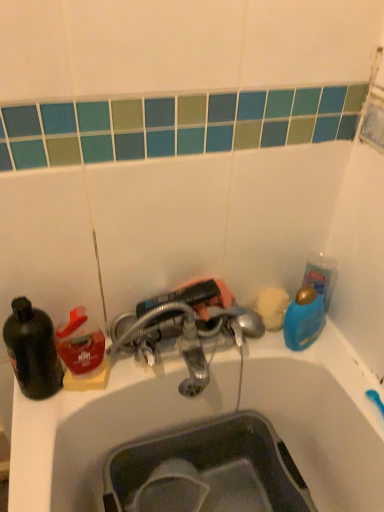
Where is `translucent plastic bottle at left`? translucent plastic bottle at left is located at coordinates (80, 343).

What do you see at coordinates (80, 343) in the screenshot?
I see `translucent plastic bottle at left` at bounding box center [80, 343].

Locate an element on the screen. blue glossy bottle at upper right is located at coordinates (303, 319).

Image resolution: width=384 pixels, height=512 pixels. Identify the location of black matte bottle at left. (32, 350).

What do you see at coordinates (185, 337) in the screenshot?
I see `metallic silver faucet at center` at bounding box center [185, 337].

Where is `translucent plastic bottle at left`? translucent plastic bottle at left is located at coordinates (80, 343).

In the scene shown: Is translucent plastic bottle at left at the right side of black matte bottle at left?

Correct, you'll find translucent plastic bottle at left to the right of black matte bottle at left.

Is black matte bottle at left at the back of translucent plastic bottle at left?

translucent plastic bottle at left does not have its back to black matte bottle at left.

Based on their sizes in the image, would you say translucent plastic bottle at left is bigger or smaller than black matte bottle at left?

In the image, translucent plastic bottle at left appears to be smaller than black matte bottle at left.

From the image's perspective, between translucent plastic bottle at left and black matte bottle at left, who is located below?

From the image's view, black matte bottle at left is below.

Does metallic silver faucet at center have a lesser height compared to blue glossy bottle at upper right?

No.

From the picture: Which is farther from the camera, (199, 375) or (290, 326)?

Point (290, 326)

Is metallic silver faucet at center beside blue glossy bottle at upper right?

They are not placed beside each other.

How different are the orientations of metallic silver faucet at center and blue glossy bottle at upper right in degrees?

metallic silver faucet at center and blue glossy bottle at upper right are facing 0.00792 degrees away from each other.

Is translucent plastic bottle at left at the back of metallic silver faucet at center?

metallic silver faucet at center is not turned away from translucent plastic bottle at left.

From a real-world perspective, which object stands above the other?

translucent plastic bottle at left.

Relative to translucent plastic bottle at left, is metallic silver faucet at center in front or behind?

In the image, metallic silver faucet at center appears in front of translucent plastic bottle at left.

At what (x,y) coordinates should I click in order to perform the action: click on tap on the right of translucent plastic bottle at left. Please return your answer as a coordinate pair (x, y). Looking at the image, I should click on (185, 337).

Based on their sizes in the image, would you say black matte bottle at left is bigger or smaller than matte gray sink at lower center?

Considering their sizes, black matte bottle at left takes up less space than matte gray sink at lower center.

Considering the points (30, 302) and (159, 446), which point is in front, point (30, 302) or point (159, 446)?

Positioned in front is point (30, 302).

Is black matte bottle at left not near matte gray sink at lower center?

No, black matte bottle at left is not far from matte gray sink at lower center.

Which object is thinner, black matte bottle at left or matte gray sink at lower center?

With smaller width is black matte bottle at left.

Is translucent plastic bottle at left to the left or to the right of matte gray sink at lower center in the image?

translucent plastic bottle at left is to the left of matte gray sink at lower center.

Can you confirm if translucent plastic bottle at left is wider than matte gray sink at lower center?

No.

Between translucent plastic bottle at left and matte gray sink at lower center, which one has larger size?

matte gray sink at lower center is bigger.

Is translucent plastic bottle at left facing towards matte gray sink at lower center?

No, translucent plastic bottle at left is not turned towards matte gray sink at lower center.

Could you tell me if matte gray sink at lower center is facing black matte bottle at left?

No, matte gray sink at lower center is not turned towards black matte bottle at left.

Would you say matte gray sink at lower center is outside black matte bottle at left?

Absolutely, matte gray sink at lower center is external to black matte bottle at left.

From the image's perspective, between matte gray sink at lower center and black matte bottle at left, who is located below?

matte gray sink at lower center is shown below in the image.

From a real-world perspective, is matte gray sink at lower center located higher than black matte bottle at left?

Actually, matte gray sink at lower center is physically below black matte bottle at left in the real world.

Considering the positions of objects blue glossy bottle at upper right and metallic silver faucet at center in the image provided, who is more to the left, blue glossy bottle at upper right or metallic silver faucet at center?

From the viewer's perspective, metallic silver faucet at center appears more on the left side.

This screenshot has height=512, width=384. Identify the location of teal below the metallic silver faucet at center (from a real-world perspective). (303, 319).

From the image's perspective, is blue glossy bottle at upper right above or below metallic silver faucet at center?

blue glossy bottle at upper right is situated higher than metallic silver faucet at center in the image.

The height and width of the screenshot is (512, 384). Find the location of `cleaning product on the right of the black matte bottle at left`. cleaning product on the right of the black matte bottle at left is located at coordinates (80, 343).

Where is `teal located behind the metallic silver faucet at center`? teal located behind the metallic silver faucet at center is located at coordinates (303, 319).

Looking at the image, which one is located closer to metallic silver faucet at center, matte gray sink at lower center or black matte bottle at left?

matte gray sink at lower center.

Estimate the real-world distances between objects in this image. Which object is further from translucent plastic bottle at left, metallic silver faucet at center or blue glossy bottle at upper right?

Based on the image, blue glossy bottle at upper right appears to be further to translucent plastic bottle at left.

Which object lies nearer to the anchor point black matte bottle at left, blue glossy bottle at upper right or translucent plastic bottle at left?

Based on the image, translucent plastic bottle at left appears to be nearer to black matte bottle at left.

Which object lies nearer to the anchor point translucent plastic bottle at left, matte gray sink at lower center or metallic silver faucet at center?

metallic silver faucet at center is closer to translucent plastic bottle at left.

Considering their positions, is metallic silver faucet at center positioned further to blue glossy bottle at upper right than translucent plastic bottle at left?

translucent plastic bottle at left is positioned further to the anchor blue glossy bottle at upper right.

Looking at the image, which one is located further to matte gray sink at lower center, metallic silver faucet at center or translucent plastic bottle at left?

Among the two, translucent plastic bottle at left is located further to matte gray sink at lower center.

Based on their spatial positions, is blue glossy bottle at upper right or translucent plastic bottle at left closer to metallic silver faucet at center?

Based on the image, translucent plastic bottle at left appears to be nearer to metallic silver faucet at center.

When comparing their distances from black matte bottle at left, does translucent plastic bottle at left or blue glossy bottle at upper right seem further?

blue glossy bottle at upper right is positioned further to the anchor black matte bottle at left.

Find the location of a particular element. The height and width of the screenshot is (512, 384). tap between translucent plastic bottle at left and matte gray sink at lower center in the up-down direction is located at coordinates (185, 337).

I want to click on tap situated between translucent plastic bottle at left and blue glossy bottle at upper right from left to right, so click(185, 337).

Find the location of a particular element. This screenshot has height=512, width=384. tap between black matte bottle at left and blue glossy bottle at upper right from left to right is located at coordinates (185, 337).

I want to click on cleaning product between black matte bottle at left and metallic silver faucet at center, so click(80, 343).